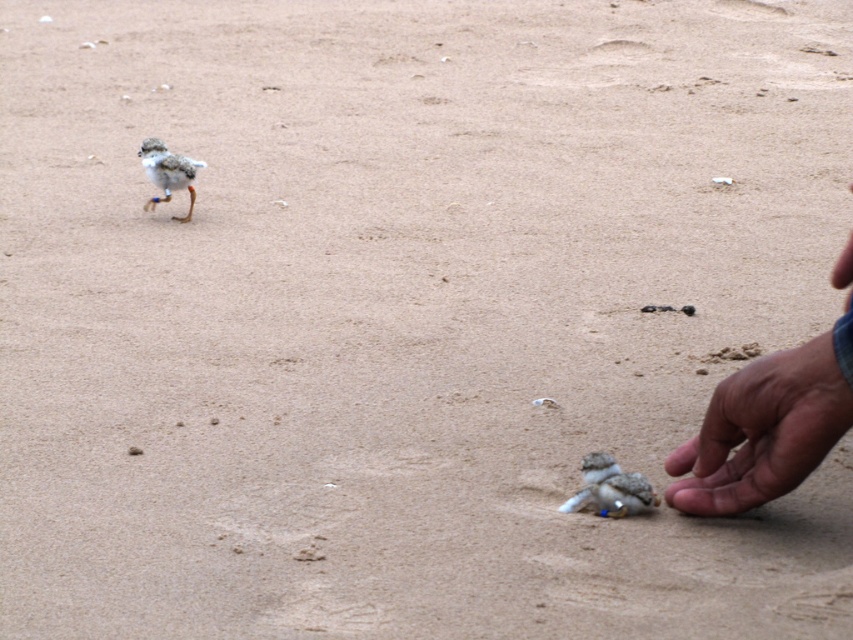
You are a photographer trying to capture both the brown skin at lower right and the speckled feathered bird at upper left in a single shot. Based on their sizes, which one will appear larger in your photo?

The brown skin at lower right appears larger in the photo because it is taller than the speckled feathered bird at upper left.

You are standing at the point marked by the coordinates point (762, 432). Looking around, what do you see immediately below you?

The coordinates point (762, 432) correspond to brown skin at lower right, so you would see brown skin immediately below you.